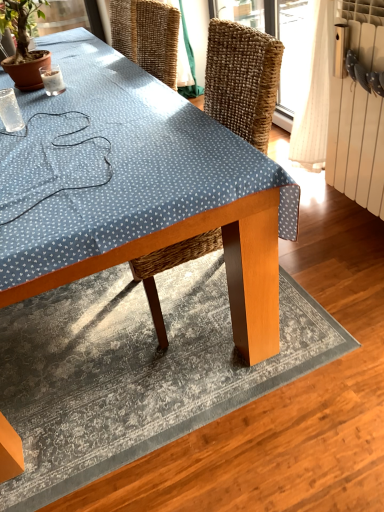
Identify the location of free spot to the right of transparent plastic cup at upper left, which ranks as the first coffee cup in front-to-back order. Image resolution: width=384 pixels, height=512 pixels. (61, 120).